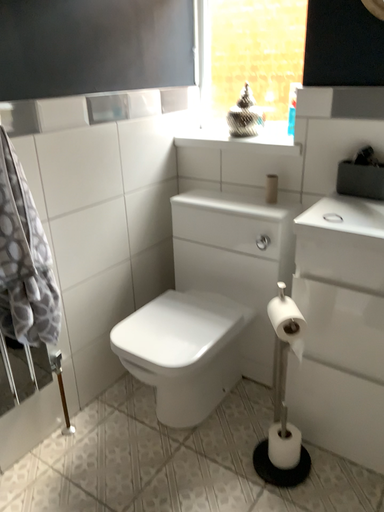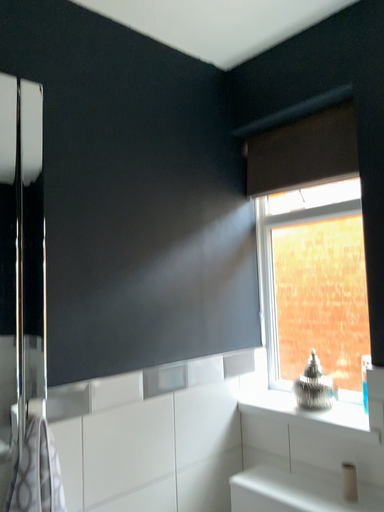
Question: Which way did the camera rotate in the video?

Choices:
 (A) rotated upward
 (B) rotated downward

Answer: (A)